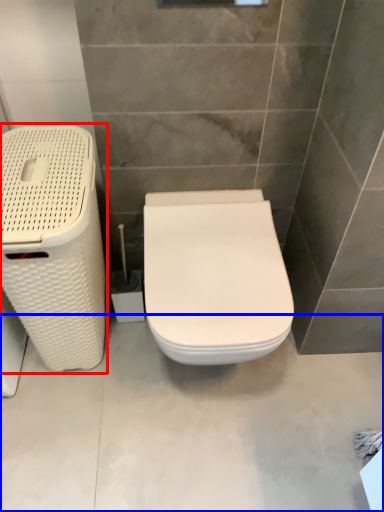
Question: Which object is closer to the camera taking this photo, laundry basket (highlighted by a red box) or concrete (highlighted by a blue box)?

Choices:
 (A) laundry basket
 (B) concrete

Answer: (A)